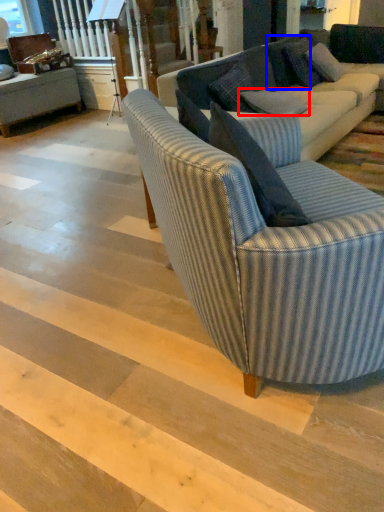
Question: Which object appears farthest to the camera in this image, pillow (highlighted by a red box) or pillow (highlighted by a blue box)?

Choices:
 (A) pillow
 (B) pillow

Answer: (B)